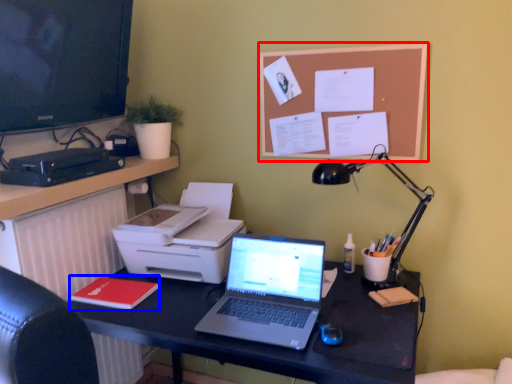
Question: Which point is closer to the camera, bulletin board (highlighted by a red box) or notepad (highlighted by a blue box)?

Choices:
 (A) bulletin board
 (B) notepad

Answer: (B)